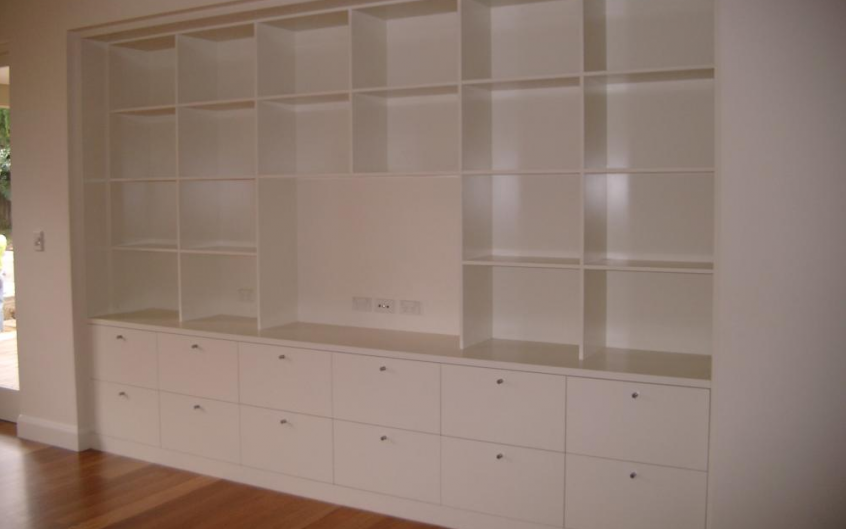
Where is `light source`? This screenshot has height=529, width=846. light source is located at coordinates (618, 190), (502, 189).